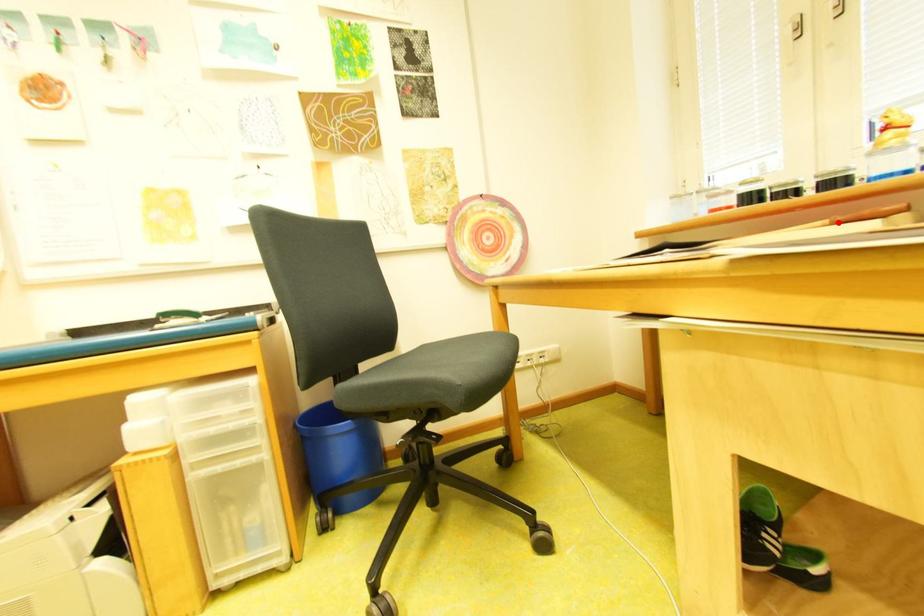
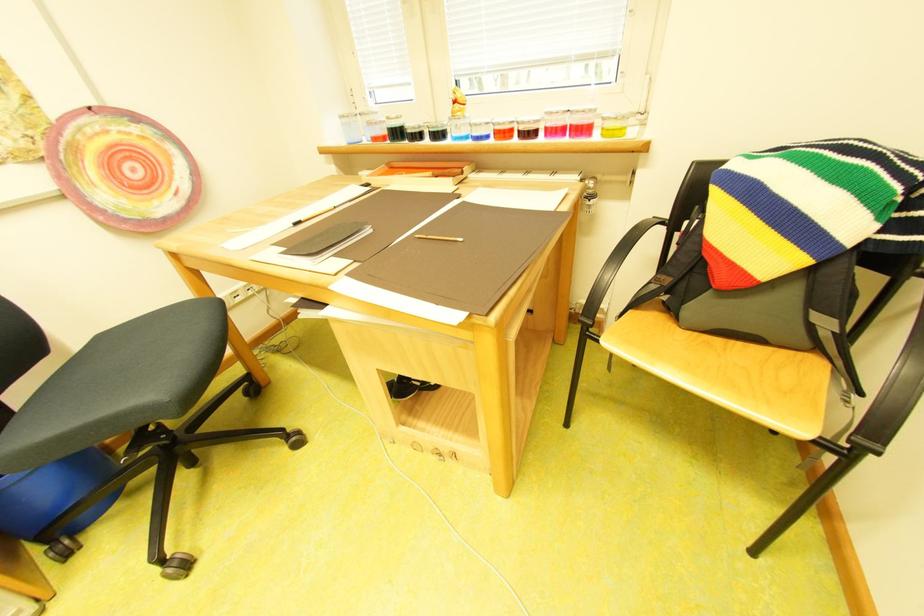
Question: I am providing you with two images of the same scene from different viewpoints. In image1, a red point is highlighted. Considering the same 3D point in image2, which of the following is correct?

Choices:
 (A) It is closer
 (B) It is farther

Answer: (A)